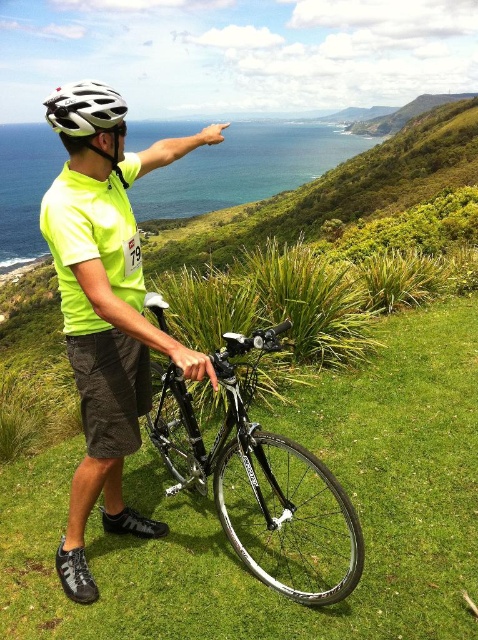
You are a photographer trying to capture the cyclist in the scene. You need to ensure both the neon yellow shirt at center and the white matte bicycle helmet at upper center are clearly visible. Given their sizes, which object might require more careful framing to avoid being overshadowed?

The white matte bicycle helmet at upper center might require more careful framing since it is smaller than the neon yellow shirt at center and could be overshadowed if not positioned thoughtfully.